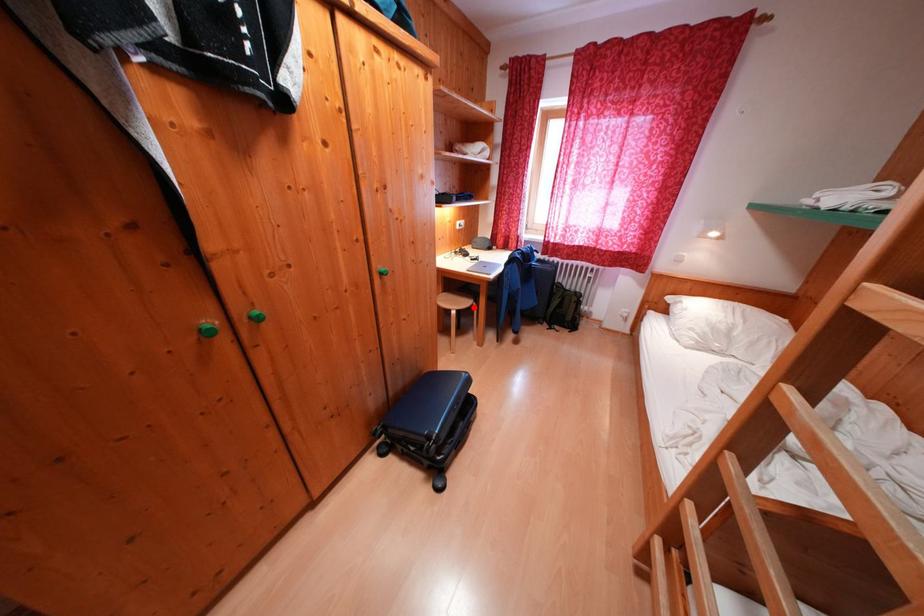
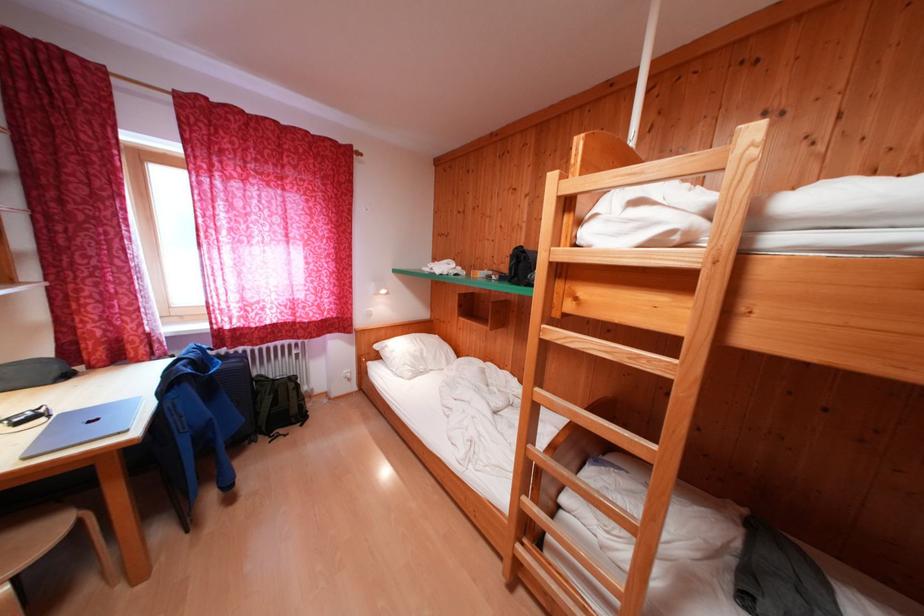
Question: I am providing you with two images of the same scene from different viewpoints. Given a red point in image1, look at the same physical point in image2. Is it:

Choices:
 (A) Closer to the viewpoint
 (B) Farther from the viewpoint

Answer: (B)